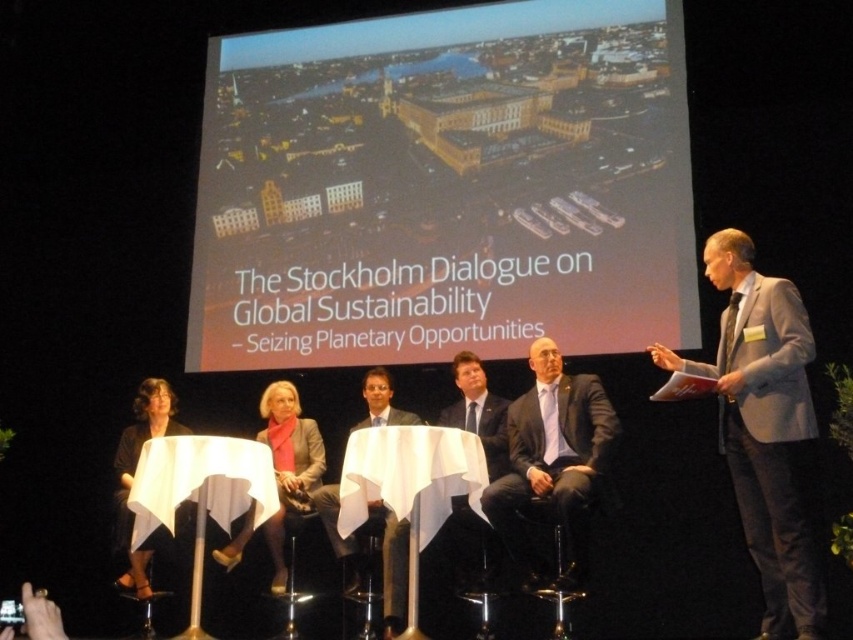
Can you confirm if matte yellow building at upper center is positioned below black fabric dress at center?

No.

Which is in front, point (410, 221) or point (132, 589)?

Point (132, 589)

Identify the location of matte yellow building at upper center. (444, 188).

Where is `matte yellow building at upper center`? This screenshot has height=640, width=853. matte yellow building at upper center is located at coordinates (444, 188).

Does point (534, 372) come farther from viewer compared to point (120, 516)?

Yes, it is.

Which is below, dark gray suit at center or black fabric dress at center?

Positioned lower is black fabric dress at center.

Is point (596, 419) positioned behind point (189, 432)?

No, (596, 419) is in front of (189, 432).

In order to click on dark gray suit at center in this screenshot , I will do click(x=552, y=460).

Which of these two, matte gray blazer at center or black fabric dress at center, stands shorter?

Standing shorter between the two is matte gray blazer at center.

Is point (305, 470) positioned behind point (128, 465)?

No.

At what (x,y) coordinates should I click in order to perform the action: click on matte gray blazer at center. Please return your answer as a coordinate pair (x, y). The image size is (853, 640). Looking at the image, I should click on (289, 465).